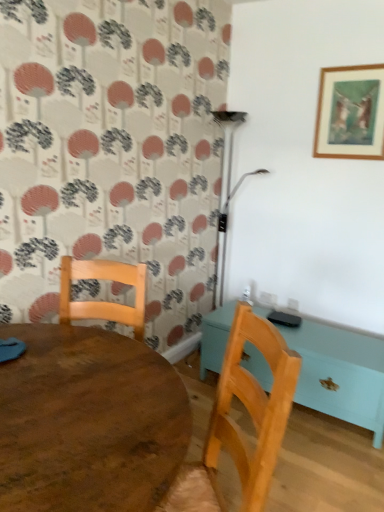
At what (x,y) coordinates should I click in order to perform the action: click on free point above wooden table at center, the 2th table from the left (from a real-world perspective). Please return your answer as a coordinate pair (x, y). This screenshot has width=384, height=512. Looking at the image, I should click on (322, 337).